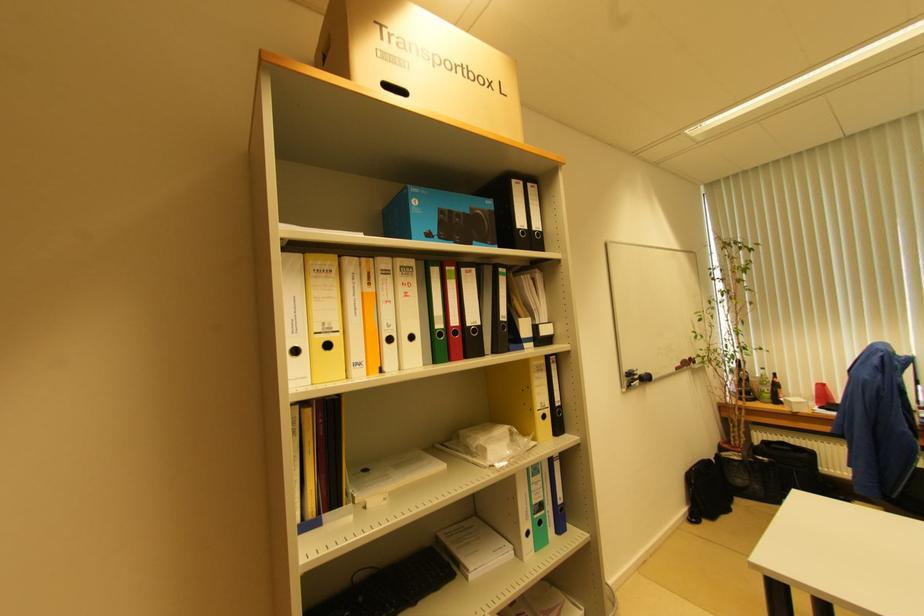
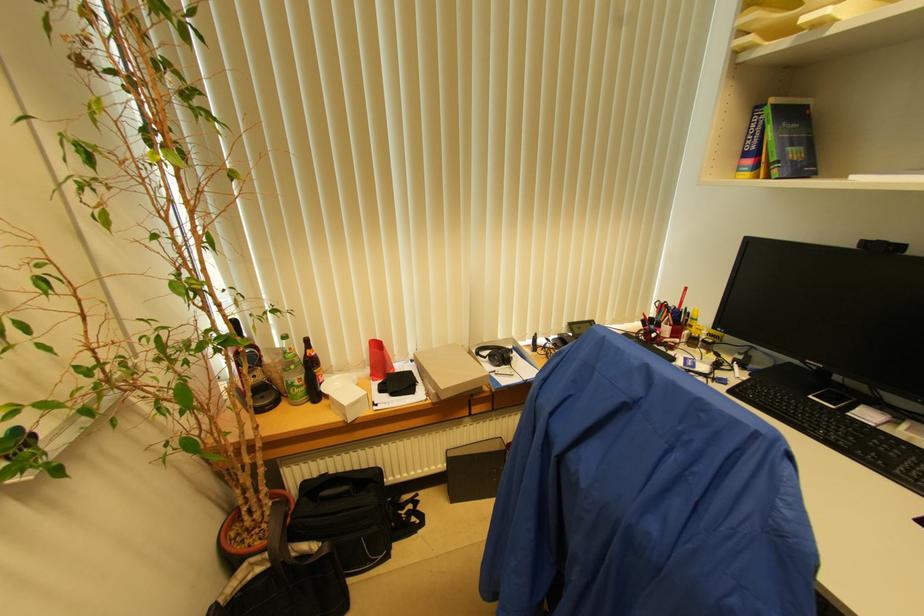
In the second image, find the point that corresponds to pixel 772 392 in the first image.

(304, 379)